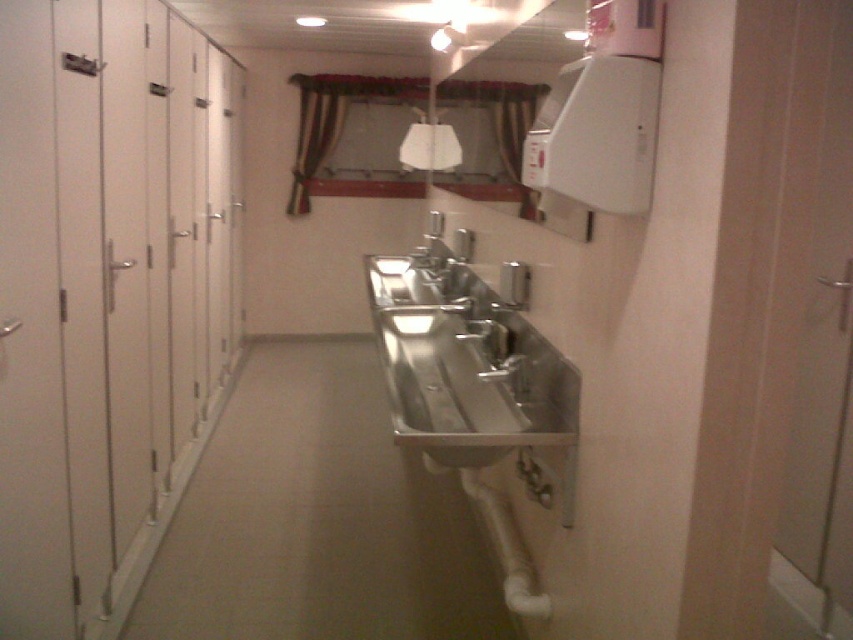
Question: Which point appears farthest from the camera in this image?

Choices:
 (A) (4, 54)
 (B) (490, 323)

Answer: (B)

Question: Which point is farther from the camera taking this photo?

Choices:
 (A) (477, 381)
 (B) (495, 349)
 (C) (151, 344)

Answer: (C)

Question: Does white matte lockers at left have a larger size compared to stainless steel sink at center?

Choices:
 (A) yes
 (B) no

Answer: (A)

Question: Which of the following is the closest to the observer?

Choices:
 (A) (494, 358)
 (B) (445, 257)
 (C) (123, 193)

Answer: (C)

Question: Can you confirm if white matte lockers at left is smaller than stainless steel sink at center?

Choices:
 (A) no
 (B) yes

Answer: (A)

Question: Does white matte lockers at left have a larger size compared to stainless steel sink at center?

Choices:
 (A) yes
 (B) no

Answer: (A)